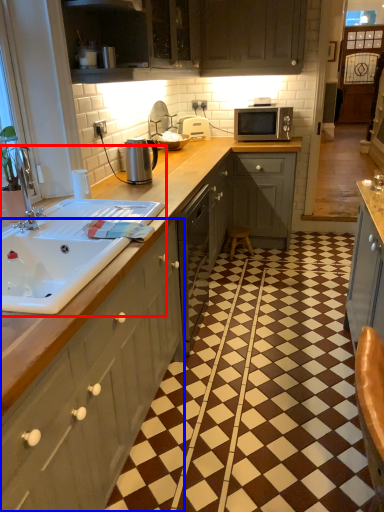
Question: Which point is closer to the camera, sink (highlighted by a red box) or cabinetry (highlighted by a blue box)?

Choices:
 (A) sink
 (B) cabinetry

Answer: (B)